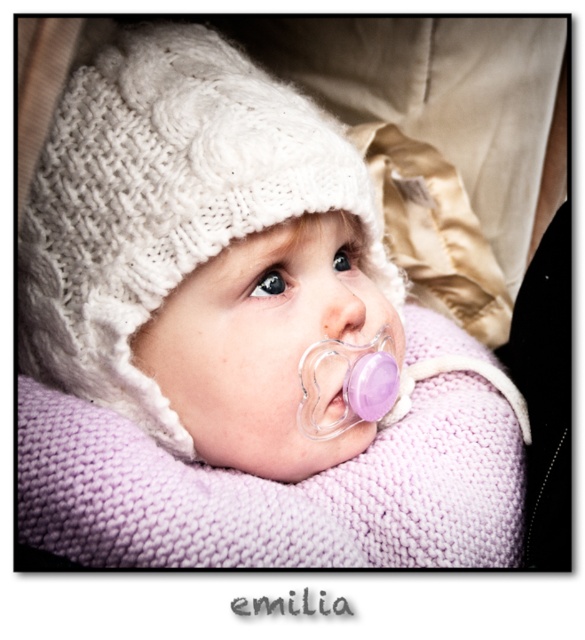
Question: Can you confirm if purple matte pacifier at center is positioned to the right of purple rubber pacifier at center?

Choices:
 (A) yes
 (B) no

Answer: (A)

Question: Is purple matte pacifier at center positioned at the back of purple rubber pacifier at center?

Choices:
 (A) yes
 (B) no

Answer: (B)

Question: Is purple matte pacifier at center further to the viewer compared to purple rubber pacifier at center?

Choices:
 (A) yes
 (B) no

Answer: (B)

Question: Which point is farther from the camera taking this photo?

Choices:
 (A) (332, 332)
 (B) (345, 408)

Answer: (B)

Question: Which point is closer to the camera taking this photo?

Choices:
 (A) (331, 305)
 (B) (342, 406)

Answer: (A)